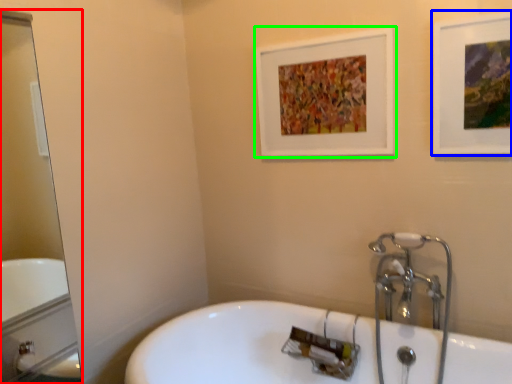
Question: Based on their relative distances, which object is farther from mirror (highlighted by a red box)? Choose from picture frame (highlighted by a blue box) and picture frame (highlighted by a green box).

Choices:
 (A) picture frame
 (B) picture frame

Answer: (A)